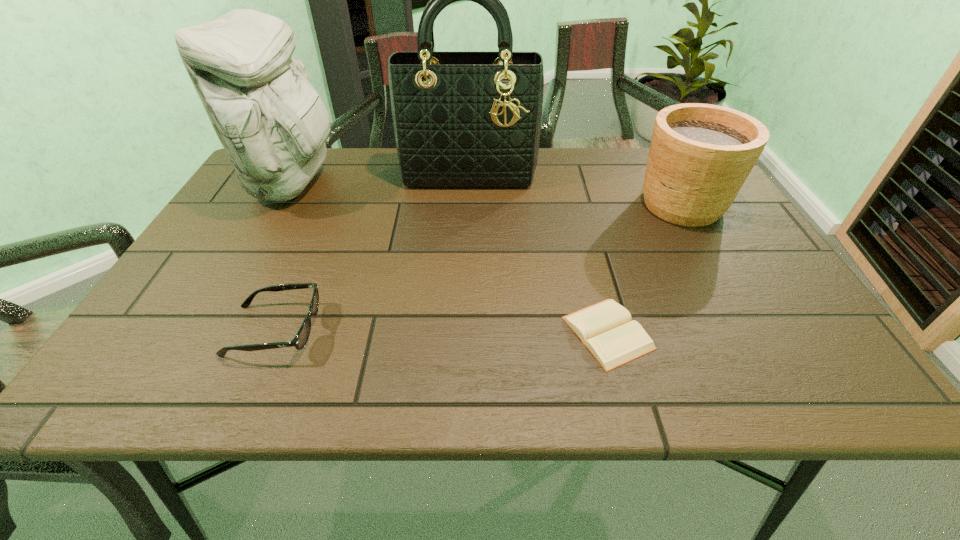
Find the location of a particular element. This screenshot has width=960, height=540. free space that satisfies the following two spatial constraints: 1. on the front-facing side of the backpack; 2. on the right side of the third shortest object is located at coordinates (281, 204).

Find the location of a particular element. Image resolution: width=960 pixels, height=540 pixels. free space that satisfies the following two spatial constraints: 1. at the front of the third object from left to right with visible charms; 2. on the right side of the rightmost object is located at coordinates (468, 204).

What are the coordinates of `free space that satisfies the following two spatial constraints: 1. at the front of the handbag with visible charms; 2. on the left side of the shortest object` in the screenshot? It's located at (463, 333).

Locate an element on the screen. free location that satisfies the following two spatial constraints: 1. at the front of the handbag with visible charms; 2. on the front-facing side of the backpack is located at coordinates (468, 183).

Image resolution: width=960 pixels, height=540 pixels. Identify the location of free spot that satisfies the following two spatial constraints: 1. at the front of the third object from left to right with visible charms; 2. on the front-facing side of the backpack. (468, 183).

This screenshot has width=960, height=540. Identify the location of vacant region that satisfies the following two spatial constraints: 1. at the front of the handbag with visible charms; 2. on the left side of the diary. (463, 333).

Where is `free space that satisfies the following two spatial constraints: 1. on the lenses of the second object from right to left; 2. on the right side of the spectacles`? The image size is (960, 540). free space that satisfies the following two spatial constraints: 1. on the lenses of the second object from right to left; 2. on the right side of the spectacles is located at coordinates (273, 333).

Identify the location of free space that satisfies the following two spatial constraints: 1. at the front of the third object from right to left with visible charms; 2. on the front-facing side of the backpack. (468, 183).

The height and width of the screenshot is (540, 960). In order to click on free space that satisfies the following two spatial constraints: 1. at the front of the third object from left to right with visible charms; 2. on the front-facing side of the backpack in this screenshot , I will do `click(468, 183)`.